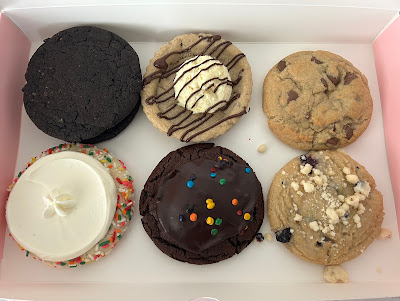
Image resolution: width=400 pixels, height=301 pixels. In order to click on crumbl cookies stacked in a crumbl cookie cardboard box in this screenshot , I will do `click(98, 92)`, `click(227, 90)`, `click(328, 96)`, `click(79, 204)`, `click(179, 204)`, `click(328, 196)`.